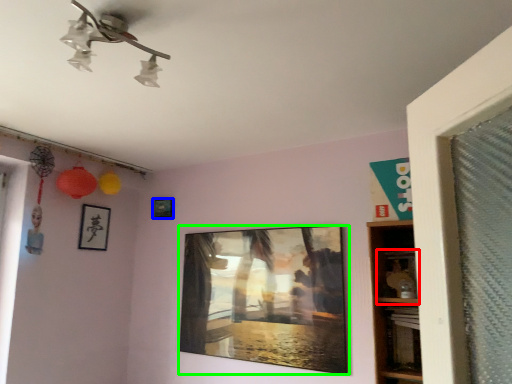
Question: Estimate the real-world distances between objects in this image. Which object is closer to shelf (highlighted by a red box), picture frame (highlighted by a blue box) or picture frame (highlighted by a green box)?

Choices:
 (A) picture frame
 (B) picture frame

Answer: (B)